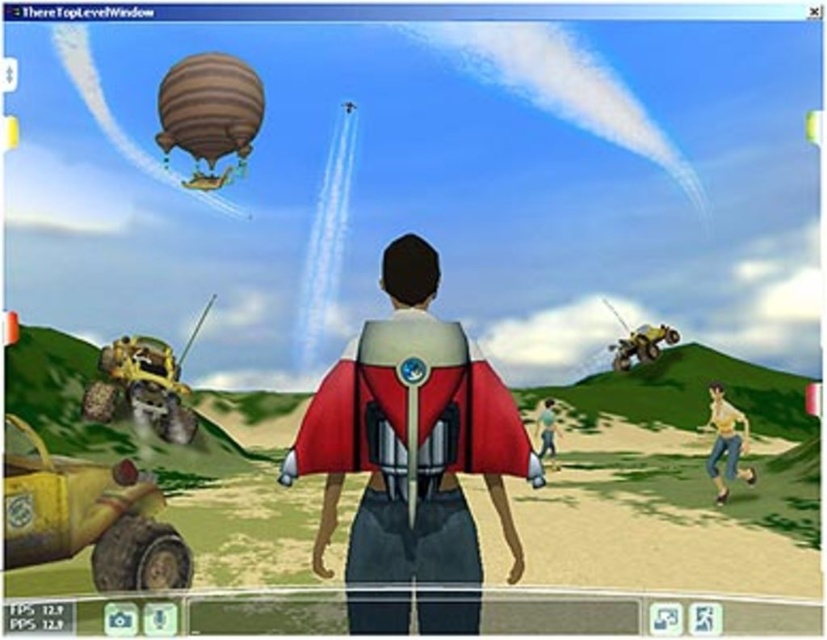
You are a character in the game and need to reach a hidden powerup located at point (x=737, y=476) and another at point (x=545, y=420). Which powerup should you collect first if you want to minimize the distance traveled from your current position?

You should collect the powerup at point (x=737, y=476) first because it is closer to the camera, meaning it is nearer to your current position compared to the other point.

Looking at this image, you are a character in the game who is standing near the striped fabric hot air balloon at upper left and the skinny jeans at lower right. You need to move from the balloon to the jeans. Which direction should you move to get closer to the jeans?

To move from the striped fabric hot air balloon at upper left to the skinny jeans at lower right, you should move towards the lower right direction since the balloon is in front of the jeans, meaning the jeans are behind the balloon in the scene.

You are a character in the game who needs to decide which item is narrower between the striped fabric hot air balloon at upper left and the skinny jeans at lower right. Which one should you choose?

The striped fabric hot air balloon at upper left is thinner than skinny jeans at lower right, so you should choose the striped fabric hot air balloon at upper left as the narrower option.